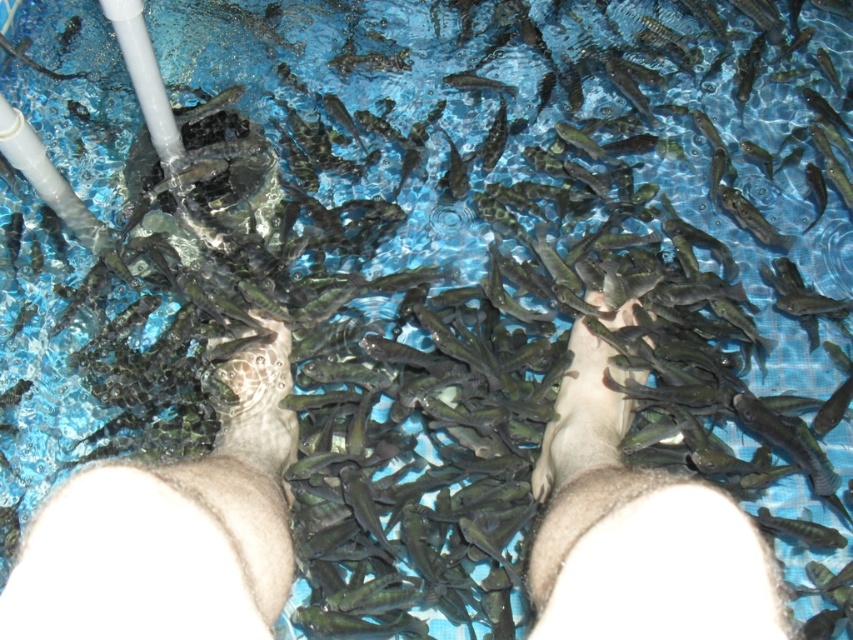
You are a customer at a fish spa and want to check if your feet are properly submerged in the water. Given that the smooth skin feet at center and brown leather foot at center are both in the water, which one is closer to the bottom of the spa?

The smooth skin feet at center is closer to the bottom of the spa because it is positioned under the brown leather foot at center.

You are a customer at a fish spa and want to locate your feet to enjoy the treatment. Where exactly are your smooth skin feet at center in the image?

Your smooth skin feet at center are located at point (170,531) in the image.

You are a spa attendant and need to place a new decorative item between the smooth skin hand at center and the brown leather foot at center. Based on their widths, which object should you place closer to the narrower one?

The smooth skin hand at center might be wider than the brown leather foot at center, so you should place the decorative item closer to the brown leather foot at center since it is narrower.